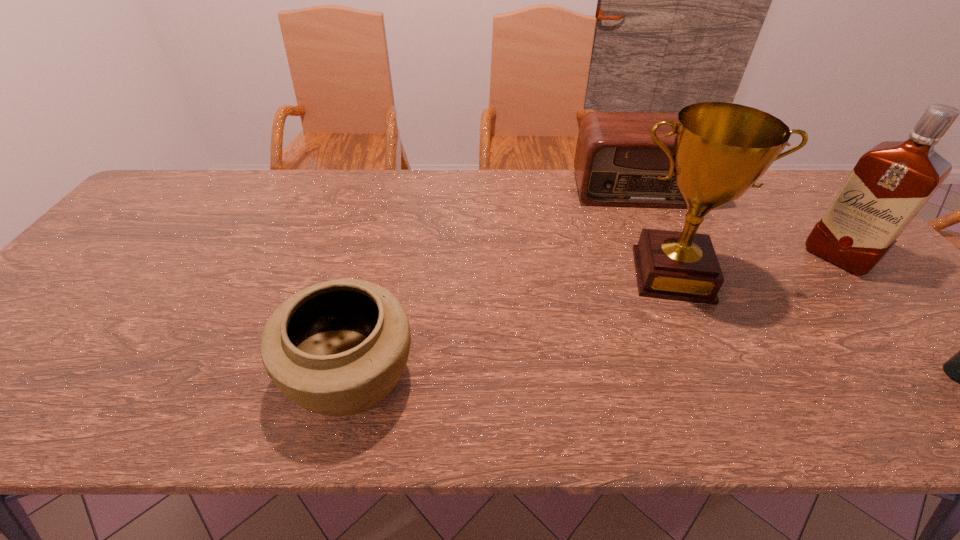
Where is `free space on the desktop that is between the pottery and the vodka and is positioned on the plaque of the award`? Image resolution: width=960 pixels, height=540 pixels. free space on the desktop that is between the pottery and the vodka and is positioned on the plaque of the award is located at coordinates [692, 375].

Where is `vacant space on the desktop that is between the pottery and the vodka and is positioned on the front label of the liquor`? vacant space on the desktop that is between the pottery and the vodka and is positioned on the front label of the liquor is located at coordinates (706, 375).

Locate an element on the screen. free space on the desktop that is between the leftmost object and the vodka and is positioned on the front panel of the radio receiver is located at coordinates (708, 375).